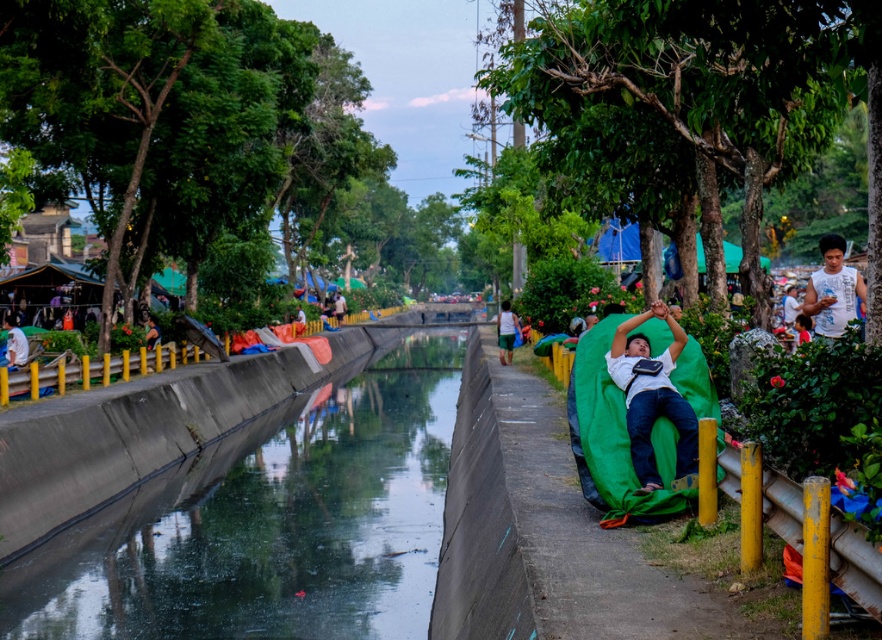
Who is shorter, matte green cushion at right or green fabric bag at center?

With less height is matte green cushion at right.

Is point (618, 362) closer to camera compared to point (514, 317)?

Yes, point (618, 362) is closer to viewer.

Which is in front, point (625, 349) or point (507, 342)?

Point (625, 349)

The width and height of the screenshot is (882, 640). What are the coordinates of `matte green cushion at right` in the screenshot? It's located at (652, 397).

This screenshot has height=640, width=882. Identify the location of smooth concrete canal at center. (268, 524).

Can you confirm if smooth concrete canal at center is positioned to the left of white cotton shirt at left?

Incorrect, smooth concrete canal at center is not on the left side of white cotton shirt at left.

This screenshot has height=640, width=882. I want to click on smooth concrete canal at center, so click(268, 524).

Who is lower down, smooth concrete canal at center or matte green cushion at right?

smooth concrete canal at center

Is smooth concrete canal at center positioned at the back of matte green cushion at right?

Yes, it is.

Find the location of a particular element. The width and height of the screenshot is (882, 640). smooth concrete canal at center is located at coordinates (268, 524).

I want to click on smooth concrete canal at center, so click(x=268, y=524).